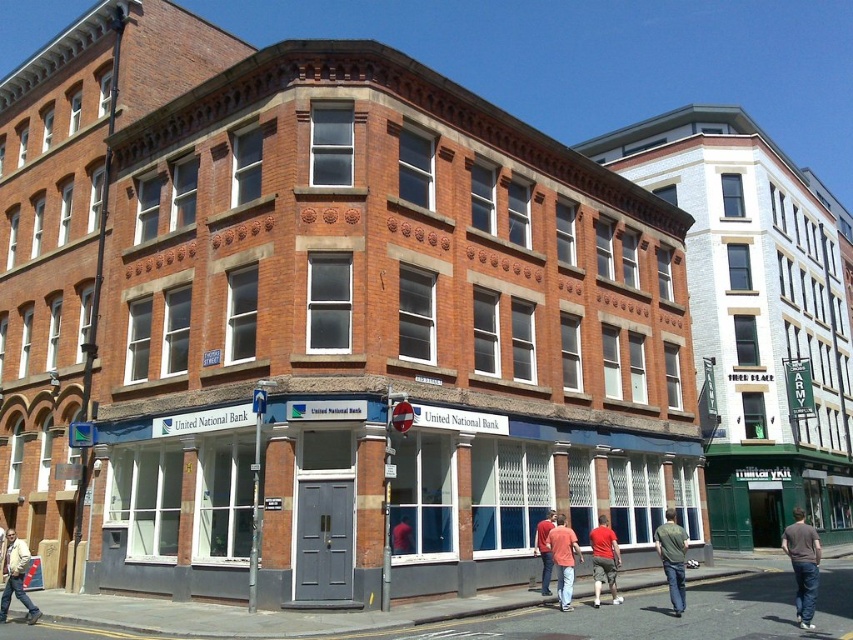
You are standing at the entrance of the United National Bank and want to place a new sign that must be exactly at the same 2D location as the brown cotton shirt at lower right. What are the coordinates you should input into the sign placement system?

The coordinates for the brown cotton shirt at lower right are at point (802, 564), so you should input 0.883 and 0.941 into the sign placement system.

You are standing at the entrance of the United National Bank on the ground floor. You see a brown cotton shirt at lower right and a red shirt at center. How far apart are these two shirts?

The brown cotton shirt at lower right and the red shirt at center are 12.58 meters apart.